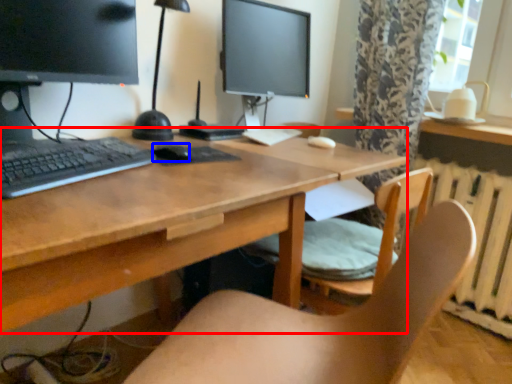
Question: Which of the following is the farthest to the observer, desk (highlighted by a red box) or mouse (highlighted by a blue box)?

Choices:
 (A) desk
 (B) mouse

Answer: (B)